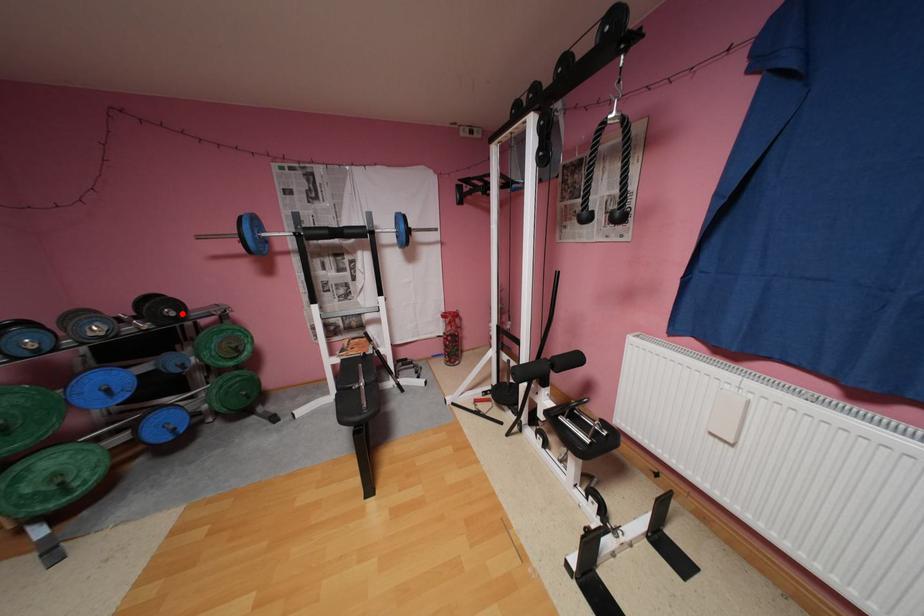
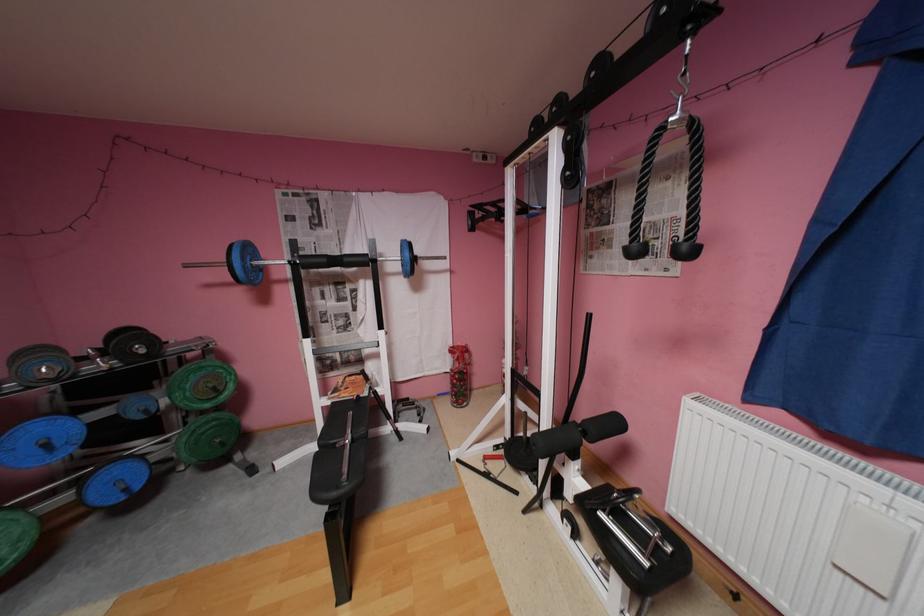
Find the pixel in the second image that matches the highlighted location in the first image.

(152, 351)